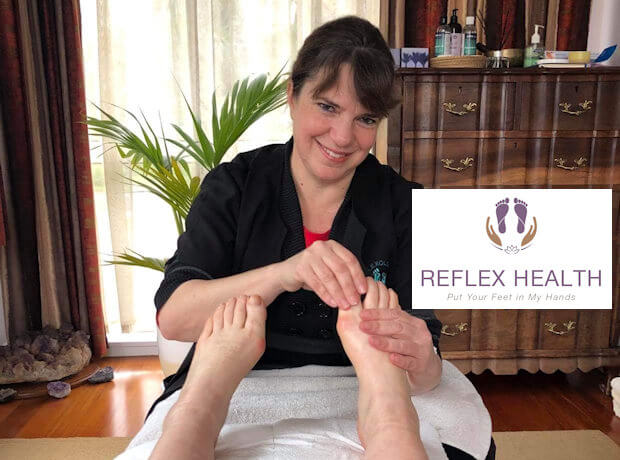
Where is `rug`? rug is located at coordinates (48, 348).